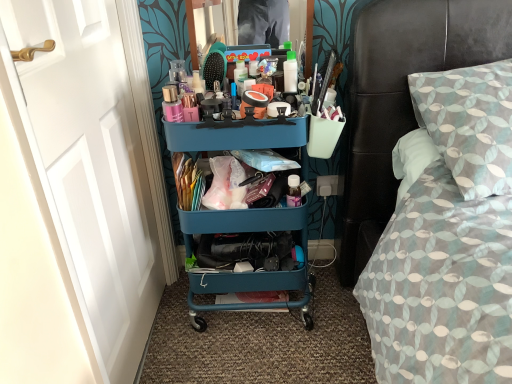
This screenshot has width=512, height=384. I want to click on free spot to the right of teal plastic cart at center, so click(x=332, y=311).